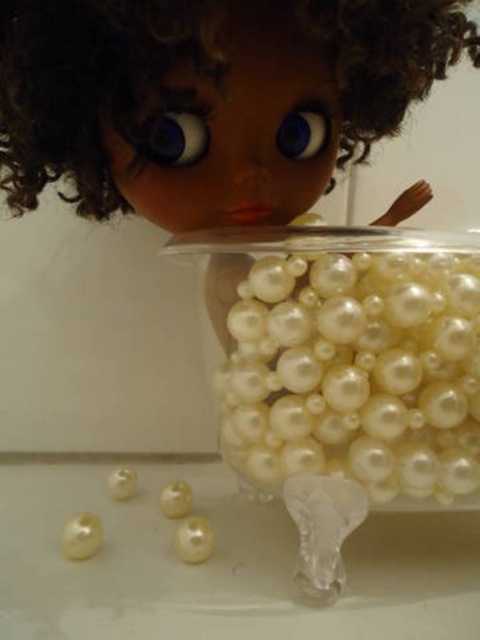
Is curly brown hair at upper center below blue glossy eye at center?

Indeed, curly brown hair at upper center is positioned under blue glossy eye at center.

This screenshot has width=480, height=640. In order to click on curly brown hair at upper center in this screenshot , I will do pyautogui.click(x=206, y=99).

Between pearl/glass at lower left and pearl-like plastic at lower center, which one is positioned lower?

pearl-like plastic at lower center is below.

Measure the distance from pearl/glass at lower left to pearl-like plastic at lower center.

A distance of 3.44 inches exists between pearl/glass at lower left and pearl-like plastic at lower center.

From the picture: Who is more distant from viewer, [82,545] or [200,522]?

Point [200,522]

Where is `pearl/glass at lower left`? pearl/glass at lower left is located at coordinates (82, 536).

Between curly brown hair at upper center and pearl-like at lower left, which one has more height?

With more height is curly brown hair at upper center.

Can you confirm if curly brown hair at upper center is positioned to the left of pearl-like at lower left?

In fact, curly brown hair at upper center is to the right of pearl-like at lower left.

Identify the location of curly brown hair at upper center. (206, 99).

Where is `curly brown hair at upper center`? The width and height of the screenshot is (480, 640). curly brown hair at upper center is located at coordinates 206,99.